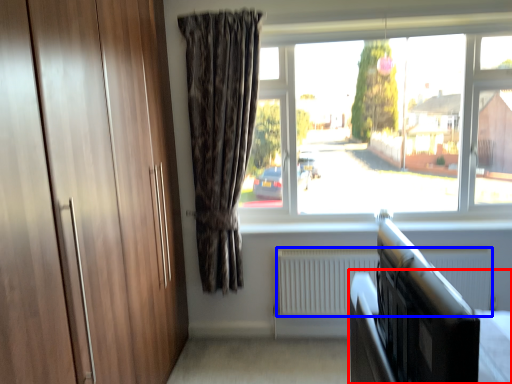
Question: Which of the following is the closest to the observer, bed frame (highlighted by a red box) or radiator (highlighted by a blue box)?

Choices:
 (A) bed frame
 (B) radiator

Answer: (A)